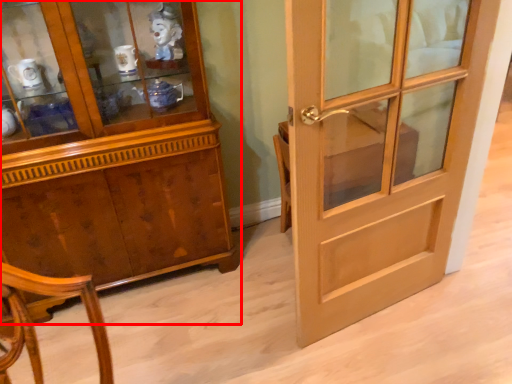
Question: From the image's perspective, where is cabinetry (annotated by the red box) located in relation to door in the image?

Choices:
 (A) below
 (B) above

Answer: (B)